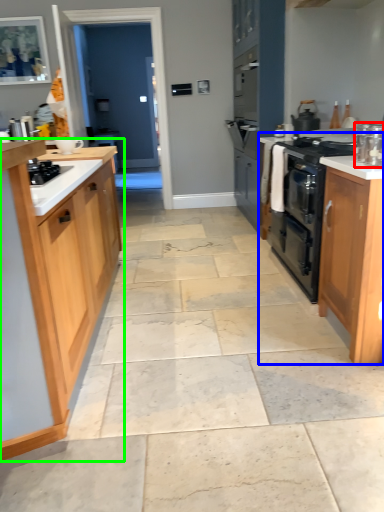
Question: Which object is positioned farthest from kitchen appliance (highlighted by a red box)? Select from counter (highlighted by a blue box) and cabinetry (highlighted by a green box).

Choices:
 (A) counter
 (B) cabinetry

Answer: (B)